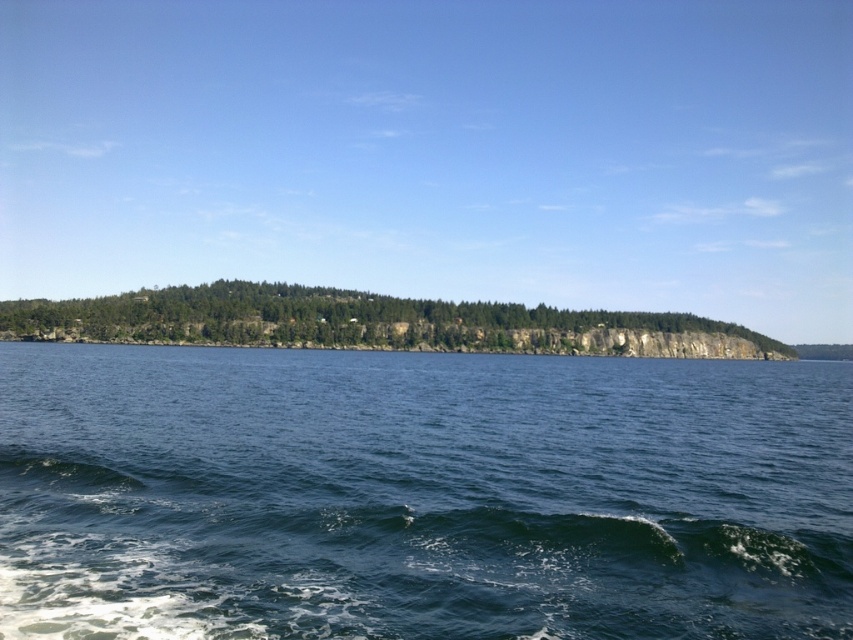
You are a bird soaring above the coastal landscape. You notice the dark blue water at center and the green leafy trees at center. Which one is located to the left when viewed from your perspective?

The dark blue water at center is positioned on the left side of green leafy trees at center, so when viewed from above, the dark blue water at center is to the left of the green leafy trees at center.

Looking at the coastal scene, you notice the dark blue water at center and the green leafy trees at center. Which of these two elements occupies a larger area in the image?

The green leafy trees at center occupy a larger area than the dark blue water at center, as the dark blue water at center is described as having a smaller size compared to the green leafy trees at center.

You are a drone operator planning to take a photo of the dark blue water at center. The drone must hover exactly at the 2D coordinates provided in the scene description. What coordinates should the drone be set to?

The drone should be set to hover at the coordinates point (421,496) to capture the dark blue water at center accurately.